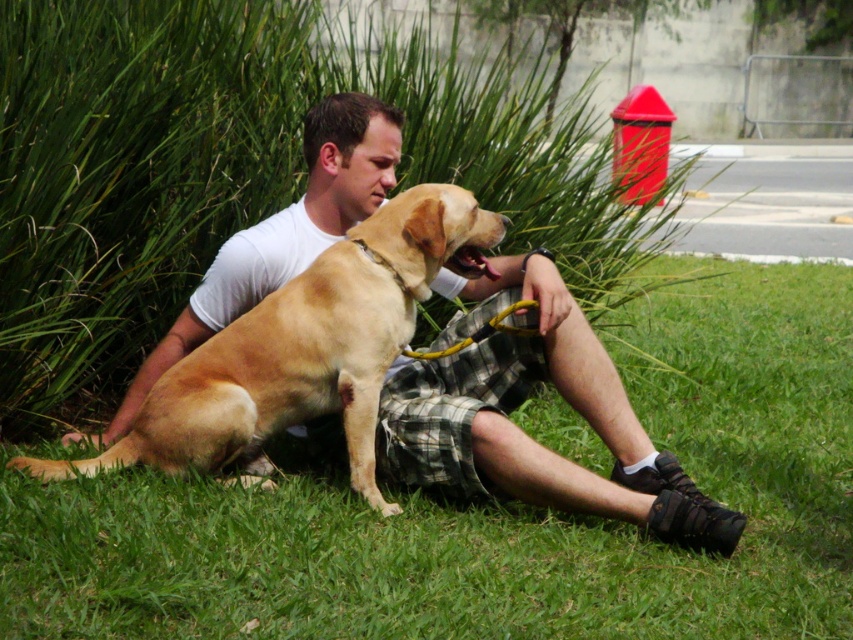
Question: Can you confirm if green grass at lower center is wider than golden fur dog at center?

Choices:
 (A) yes
 (B) no

Answer: (B)

Question: Which is nearer to the golden fur dog at center?

Choices:
 (A) matte white t-shirt at center
 (B) green grass at lower center

Answer: (A)

Question: Which of the following is the farthest from the observer?

Choices:
 (A) matte white t-shirt at center
 (B) green grass at lower center
 (C) golden fur dog at center

Answer: (A)

Question: Which point is farther to the camera?

Choices:
 (A) click(x=630, y=394)
 (B) click(x=483, y=472)
 (C) click(x=374, y=502)

Answer: (A)

Question: Is matte white t-shirt at center bigger than golden fur dog at center?

Choices:
 (A) no
 (B) yes

Answer: (B)

Question: Can you confirm if matte white t-shirt at center is positioned to the right of golden fur dog at center?

Choices:
 (A) yes
 (B) no

Answer: (A)